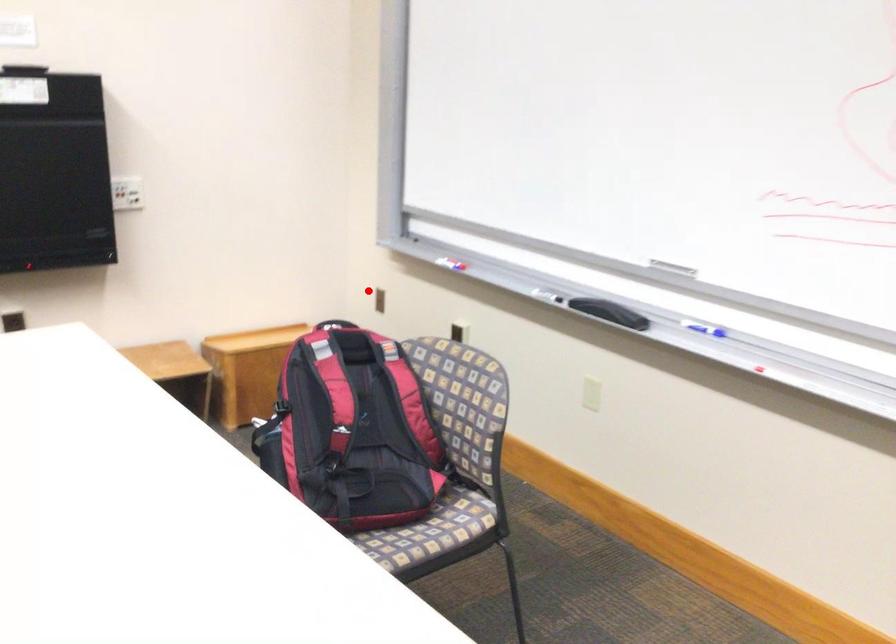
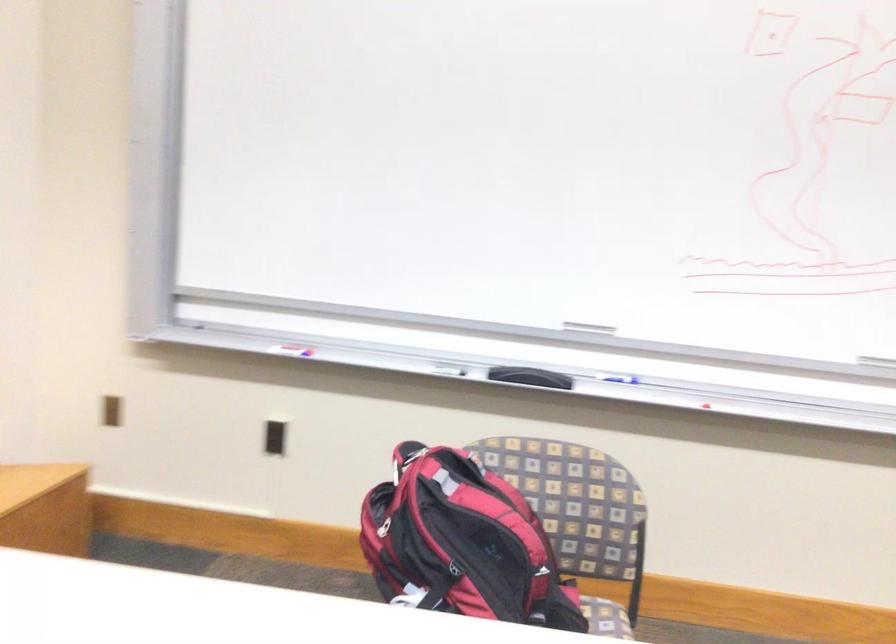
In the second image, find the point that corresponds to the highlighted location in the first image.

(112, 410)